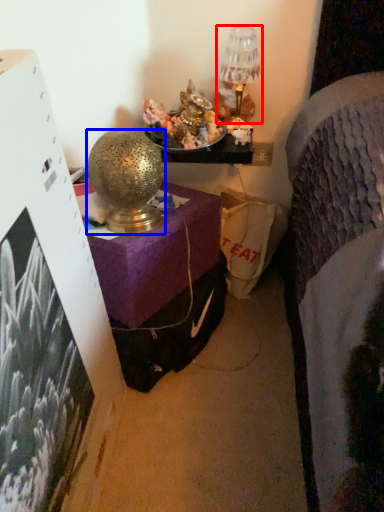
Question: Which object is closer to the camera taking this photo, table lamp (highlighted by a red box) or table lamp (highlighted by a blue box)?

Choices:
 (A) table lamp
 (B) table lamp

Answer: (B)